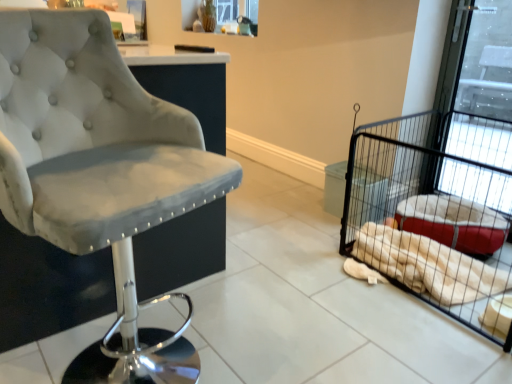
Question: From the image's perspective, is white plush blanket at right under black wire pet cage at right?

Choices:
 (A) no
 (B) yes

Answer: (B)

Question: Does white plush blanket at right appear on the right side of black wire pet cage at right?

Choices:
 (A) yes
 (B) no

Answer: (B)

Question: Is white plush blanket at right not within black wire pet cage at right?

Choices:
 (A) no
 (B) yes

Answer: (A)

Question: From the image's perspective, is white plush blanket at right above black wire pet cage at right?

Choices:
 (A) no
 (B) yes

Answer: (A)

Question: Is white plush blanket at right closer to camera compared to black wire pet cage at right?

Choices:
 (A) yes
 (B) no

Answer: (B)

Question: Relative to white plush blanket at right, is black wire pet cage at right in front or behind?

Choices:
 (A) front
 (B) behind

Answer: (A)

Question: Considering the positions of point (483, 231) and point (460, 258), is point (483, 231) closer or farther from the camera than point (460, 258)?

Choices:
 (A) closer
 (B) farther

Answer: (B)

Question: In terms of height, does black wire pet cage at right look taller or shorter compared to white plush blanket at right?

Choices:
 (A) tall
 (B) short

Answer: (A)

Question: Would you say black wire pet cage at right is to the left or to the right of white plush blanket at right in the picture?

Choices:
 (A) right
 (B) left

Answer: (A)

Question: From the image's perspective, relative to black wire pet cage at right, is white plush blanket at right above or below?

Choices:
 (A) below
 (B) above

Answer: (A)

Question: Considering the relative positions of white plush blanket at right and black wire pet cage at right in the image provided, is white plush blanket at right to the left or to the right of black wire pet cage at right?

Choices:
 (A) left
 (B) right

Answer: (A)

Question: From their relative heights in the image, would you say white plush blanket at right is taller or shorter than black wire pet cage at right?

Choices:
 (A) tall
 (B) short

Answer: (B)

Question: From a real-world perspective, is white plush blanket at right above or below black wire pet cage at right?

Choices:
 (A) above
 (B) below

Answer: (B)

Question: In the image, is velvet grey chair at left on the left side or the right side of white plush blanket at right?

Choices:
 (A) right
 (B) left

Answer: (B)

Question: Considering the positions of point click(3, 190) and point click(399, 235), is point click(3, 190) closer or farther from the camera than point click(399, 235)?

Choices:
 (A) farther
 (B) closer

Answer: (B)